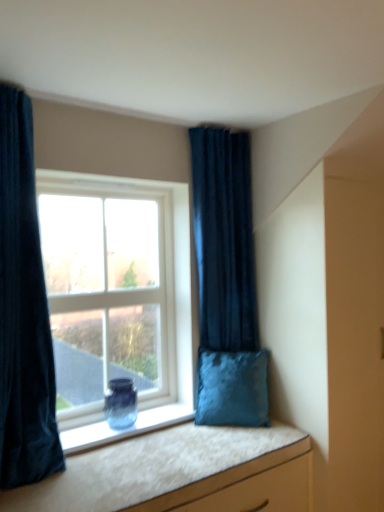
Identify the location of vacant space underneath velvet dark blue curtain at left, the 1th curtain viewed from the front (from a real-world perspective). (44, 483).